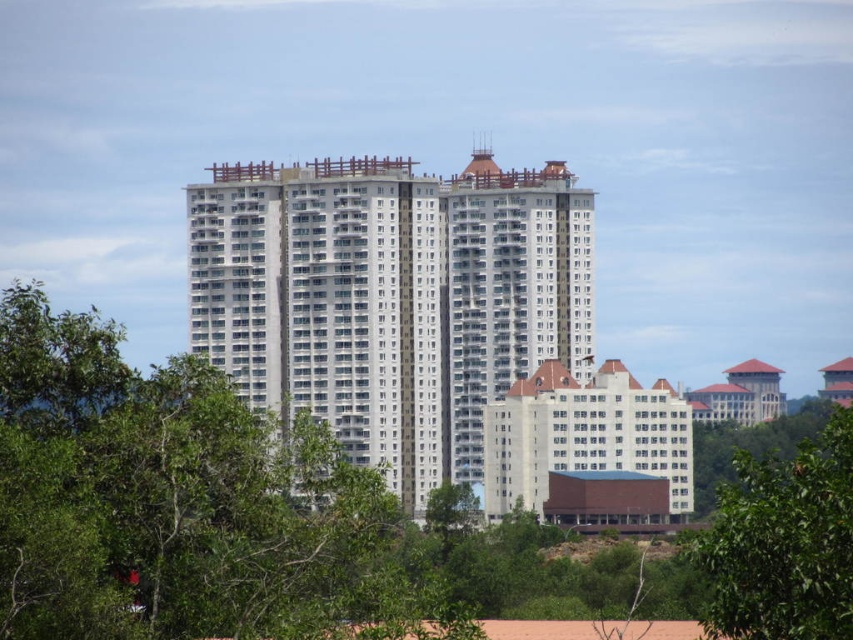
Question: Is white concrete building at center thinner than green leafy tree at lower right?

Choices:
 (A) no
 (B) yes

Answer: (A)

Question: Estimate the real-world distances between objects in this image. Which object is closer to the green leafy tree at center?

Choices:
 (A) white concrete building at center
 (B) green leafy tree at lower right

Answer: (A)

Question: Is green leafy tree at center bigger than green leafy tree at lower right?

Choices:
 (A) no
 (B) yes

Answer: (B)

Question: Among these points, which one is farthest from the camera?

Choices:
 (A) (805, 557)
 (B) (453, 401)
 (C) (260, 624)

Answer: (B)

Question: Among these objects, which one is nearest to the camera?

Choices:
 (A) green leafy tree at center
 (B) green leafy tree at lower right

Answer: (B)

Question: Is green leafy tree at center bigger than green leafy tree at lower right?

Choices:
 (A) yes
 (B) no

Answer: (A)